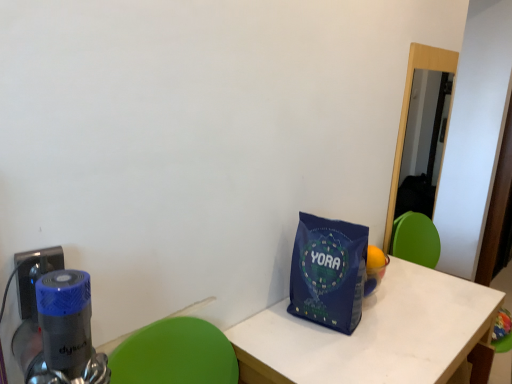
Question: Considering their positions, is white matte table at center located in front of or behind blue plastic electric outlet at lower left?

Choices:
 (A) behind
 (B) front

Answer: (A)

Question: Does point click(278, 317) appear closer or farther from the camera than point click(30, 271)?

Choices:
 (A) closer
 (B) farther

Answer: (B)

Question: Which of these objects is positioned closest to the white matte table at center?

Choices:
 (A) blue fabric tote bag at lower right
 (B) blue plastic electric outlet at lower left

Answer: (A)

Question: Which of these objects is positioned closest to the blue fabric tote bag at lower right?

Choices:
 (A) blue plastic electric outlet at lower left
 (B) white matte table at center

Answer: (B)